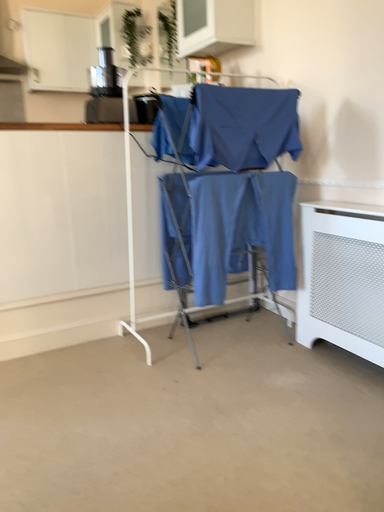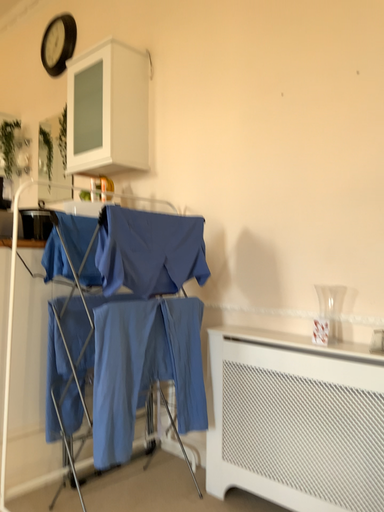
Question: How did the camera likely rotate when shooting the video?

Choices:
 (A) rotated left
 (B) rotated right

Answer: (B)